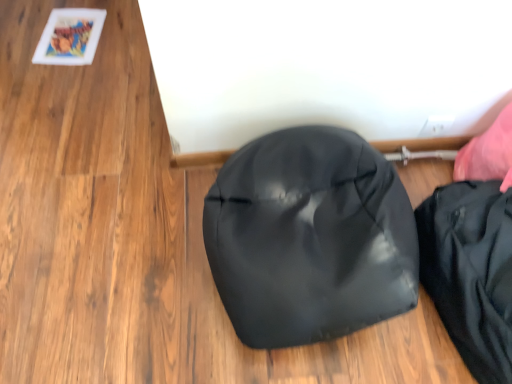
Question: Can you confirm if black matte pouch at lower right is positioned to the right of matte black shoe at center?

Choices:
 (A) no
 (B) yes

Answer: (B)

Question: Is matte black shoe at center a part of black matte pouch at lower right?

Choices:
 (A) no
 (B) yes

Answer: (A)

Question: Considering the relative sizes of black matte pouch at lower right and matte black shoe at center in the image provided, is black matte pouch at lower right bigger than matte black shoe at center?

Choices:
 (A) no
 (B) yes

Answer: (A)

Question: Could you tell me if black matte pouch at lower right is facing matte black shoe at center?

Choices:
 (A) yes
 (B) no

Answer: (B)

Question: Would you say black matte pouch at lower right is outside matte black shoe at center?

Choices:
 (A) yes
 (B) no

Answer: (A)

Question: Is black matte pouch at lower right positioned before matte black shoe at center?

Choices:
 (A) no
 (B) yes

Answer: (A)

Question: Can you confirm if matte black shoe at center is thinner than black matte pouch at lower right?

Choices:
 (A) no
 (B) yes

Answer: (A)

Question: From the image's perspective, is matte black shoe at center on top of black matte pouch at lower right?

Choices:
 (A) no
 (B) yes

Answer: (B)

Question: Is matte black shoe at center oriented away from black matte pouch at lower right?

Choices:
 (A) no
 (B) yes

Answer: (A)

Question: From a real-world perspective, is matte black shoe at center on black matte pouch at lower right?

Choices:
 (A) no
 (B) yes

Answer: (B)

Question: Does matte black shoe at center have a greater height compared to black matte pouch at lower right?

Choices:
 (A) no
 (B) yes

Answer: (A)

Question: Can you confirm if matte black shoe at center is smaller than black matte pouch at lower right?

Choices:
 (A) yes
 (B) no

Answer: (B)

Question: From a real-world perspective, is black matte pouch at lower right physically located above or below matte black shoe at center?

Choices:
 (A) below
 (B) above

Answer: (A)